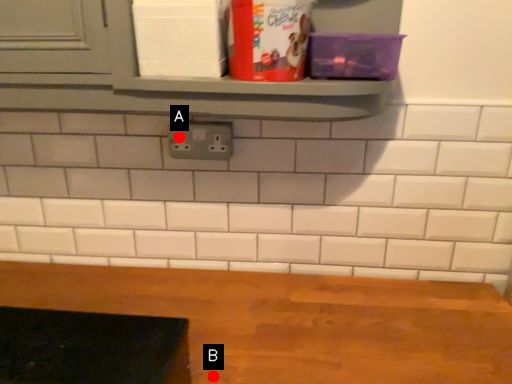
Question: Two points are circled on the image, labeled by A and B beside each circle. Which of the following is the farthest from the observer?

Choices:
 (A) A is further
 (B) B is further

Answer: (A)